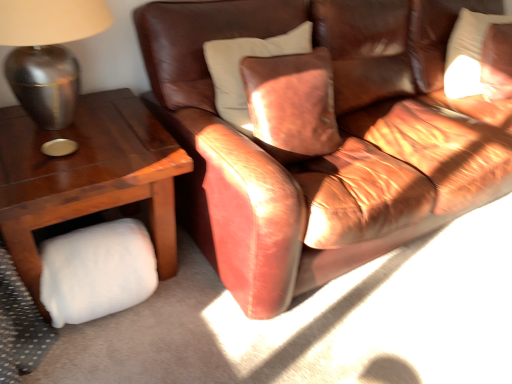
Image resolution: width=512 pixels, height=384 pixels. Identify the location of vacant space to the right of white fluffy pillow at lower left. [x=184, y=315].